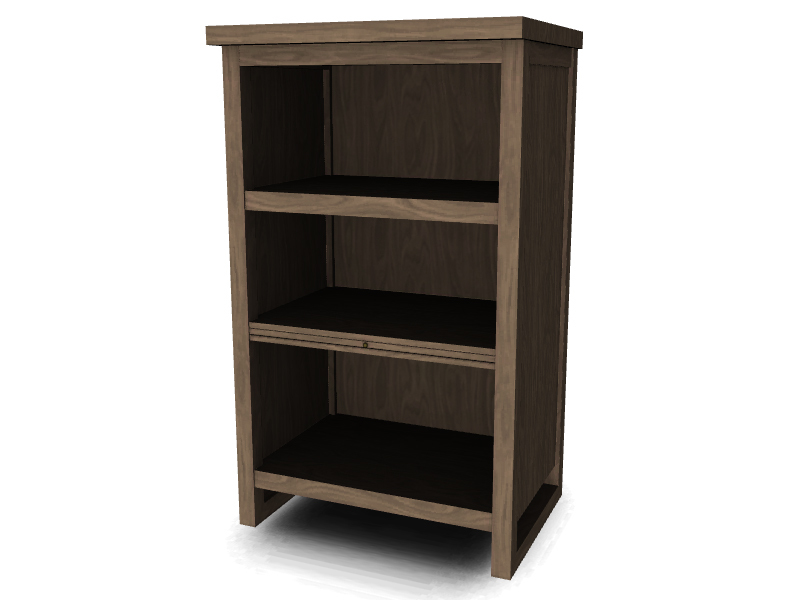
Where is `brown back panel`? brown back panel is located at coordinates [418, 392].